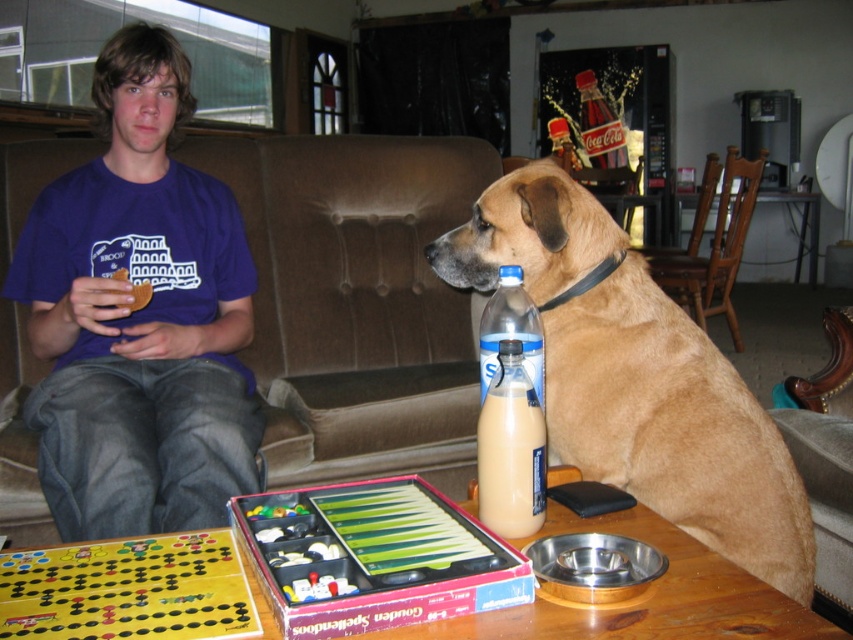
Question: Among these points, which one is nearest to the camera?

Choices:
 (A) click(x=619, y=636)
 (B) click(x=503, y=268)
 (C) click(x=102, y=420)
 (D) click(x=543, y=424)

Answer: (A)

Question: Can you confirm if wooden table at center is positioned to the left of translucent plastic bottle at dog right?

Choices:
 (A) no
 (B) yes

Answer: (B)

Question: In this image, where is brown fabric couch at left located relative to milky white plastic bottle at center?

Choices:
 (A) left
 (B) right

Answer: (A)

Question: Which of the following is the closest to the observer?

Choices:
 (A) (56, 433)
 (B) (628, 336)
 (C) (9, 150)
 (D) (508, 301)

Answer: (D)

Question: Which object is closer to the camera taking this photo?

Choices:
 (A) milky white plastic bottle at center
 (B) blue t-shirt at center

Answer: (A)

Question: Is blue t-shirt at center further to the viewer compared to brown fabric couch at left?

Choices:
 (A) yes
 (B) no

Answer: (B)